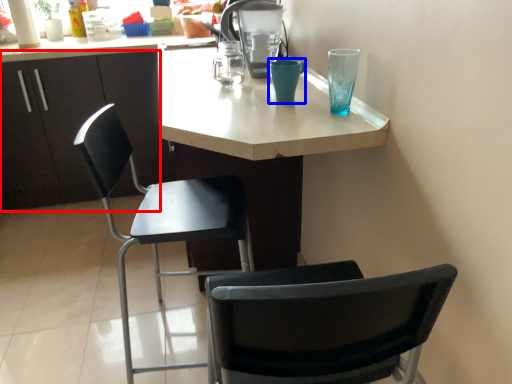
Question: Which object appears farthest to the camera in this image, cabinetry (highlighted by a red box) or teal (highlighted by a blue box)?

Choices:
 (A) cabinetry
 (B) teal

Answer: (A)